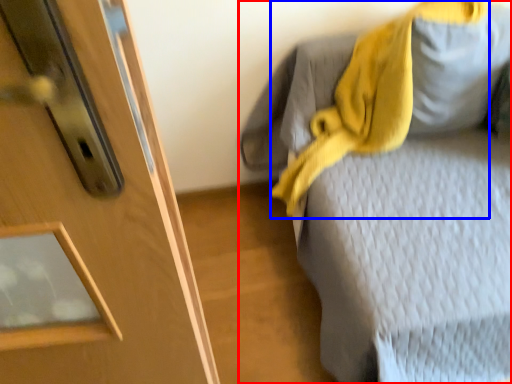
Question: Which object appears farthest to the camera in this image, furniture (highlighted by a red box) or scarf (highlighted by a blue box)?

Choices:
 (A) furniture
 (B) scarf

Answer: (B)